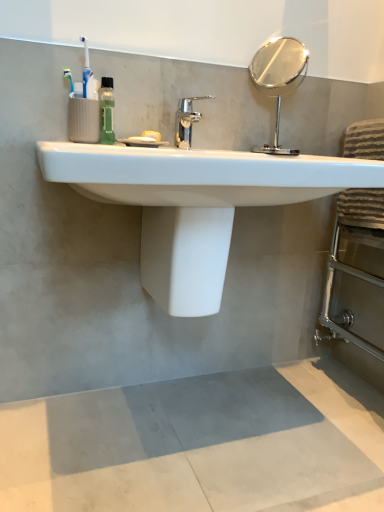
This screenshot has width=384, height=512. In order to click on blank area beneath white glossy sink at center (from a real-world perspective) in this screenshot , I will do `click(195, 418)`.